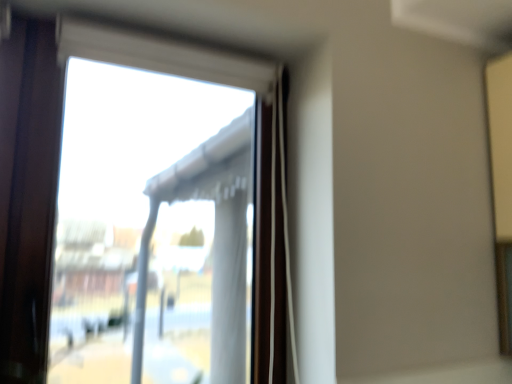
The image size is (512, 384). I want to click on transparent glass window at center, so click(x=200, y=79).

This screenshot has width=512, height=384. What do you see at coordinates (200, 79) in the screenshot?
I see `transparent glass window at center` at bounding box center [200, 79].

Find the location of `transparent glass window at center`. transparent glass window at center is located at coordinates (200, 79).